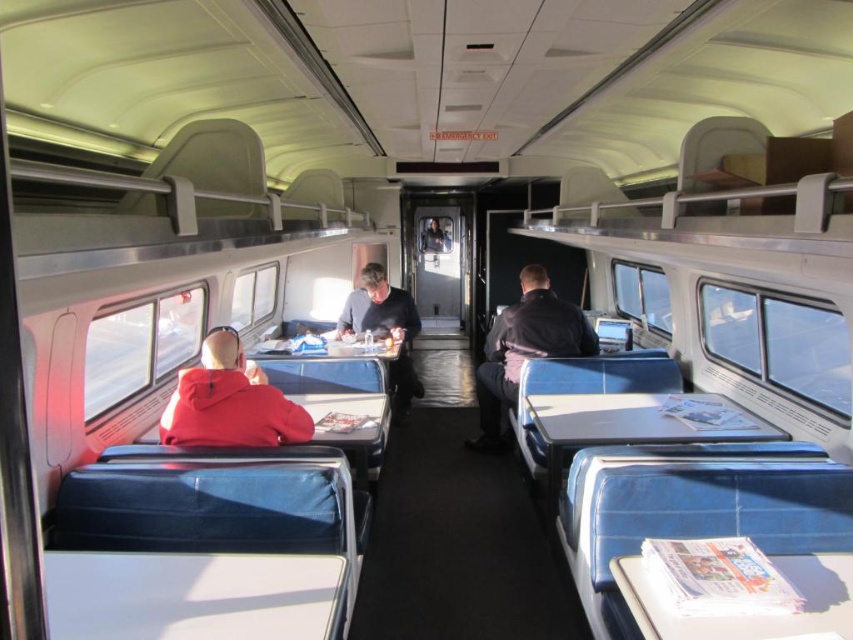
Consider the image. A passenger is sitting at the point marked as point [253,432] and wants to reach the emergency exit located at the other point. What is the minimum distance they need to walk?

The minimum distance the passenger needs to walk is 3.22 meters.

You are a passenger on a train and need to move from your seat to the restroom, which is located behind the dark blue leather jacket at center. The red fleece jacket at left is blocking your path. Can you walk around it without moving the jackets?

The distance between the red fleece jacket at left and the dark blue leather jacket at center is 7.29 feet. Since the jackets are 7.29 feet apart, you can easily walk around the red fleece jacket at left to reach the dark blue leather jacket at center and the restroom beyond it.